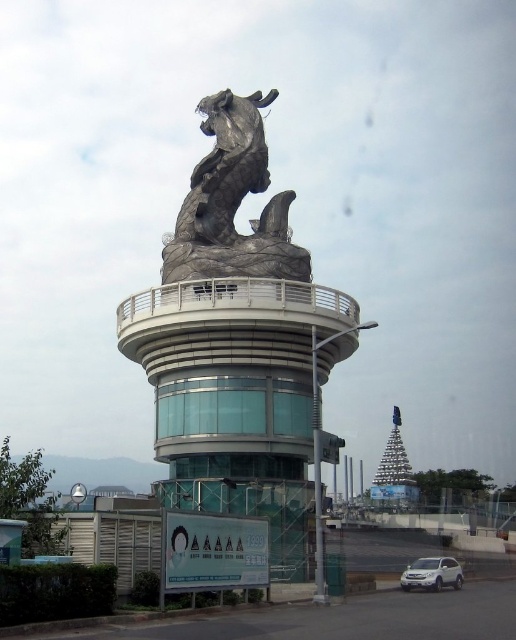
You are standing in front of the dragon sculpture on the cylindrical building. You see a point marked at coordinates (233, 202). Based on the scene description, can you identify what object this point is located on?

The point marked at coordinates (233, 202) is located on the shiny silver horse at center.